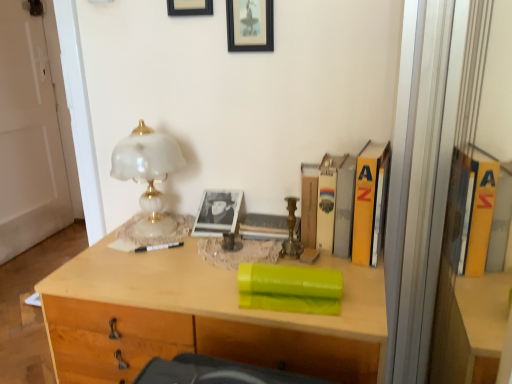
Where is `vacant space situated on the left part of black plastic pen at center`? The image size is (512, 384). vacant space situated on the left part of black plastic pen at center is located at coordinates point(100,259).